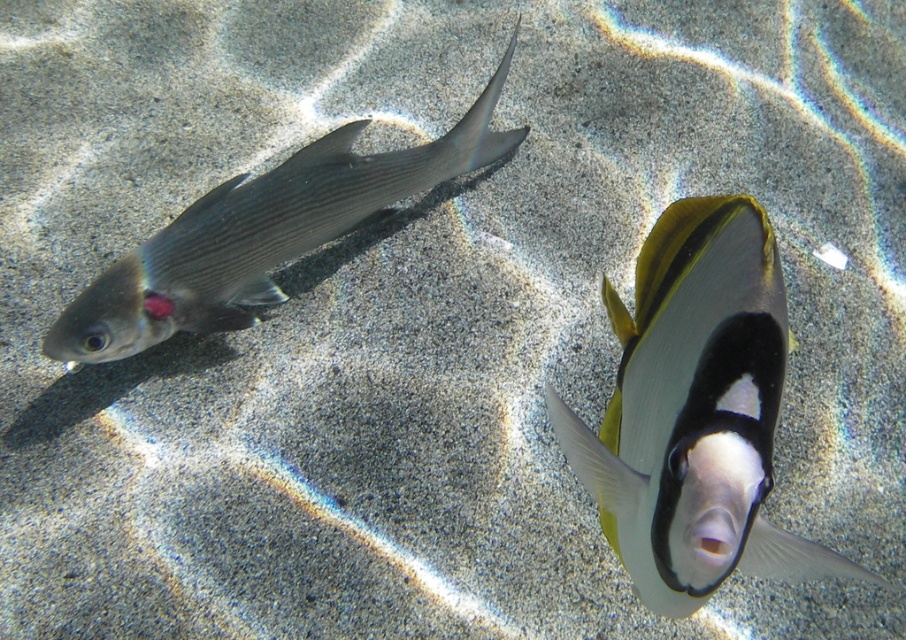
Is black glossy fish at center thinner than shiny silver fish at left?

Correct, black glossy fish at center's width is less than shiny silver fish at left's.

Between point (625, 365) and point (468, 129), which one is positioned in front?

Point (625, 365) is more forward.

Identify the location of black glossy fish at center. 695,412.

Find the location of `black glossy fish at center`. black glossy fish at center is located at coordinates 695,412.